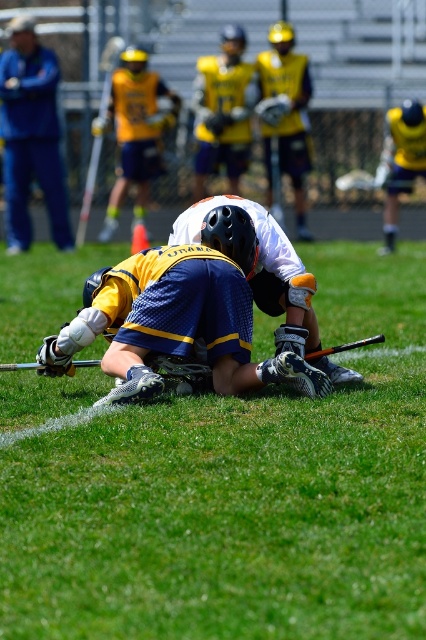
Question: Considering the real-world distances, which object is closest to the matte white hockey stick at upper left?

Choices:
 (A) blue mesh jersey at center
 (B) blue jersey at center

Answer: (B)

Question: Where is blue fabric jersey at center located in relation to black matte hockey stick at center in the image?

Choices:
 (A) left
 (B) right

Answer: (A)

Question: Estimate the real-world distances between objects in this image. Which object is farther from the black matte hockey stick at center?

Choices:
 (A) blue fabric jacket at upper left
 (B) blue jersey at center
 (C) blue fabric jersey at center
 (D) blue mesh jersey at center

Answer: (A)

Question: Can you confirm if blue mesh jersey at center is positioned to the right of blue fabric jacket at upper left?

Choices:
 (A) yes
 (B) no

Answer: (A)

Question: Which object is closer to the camera taking this photo?

Choices:
 (A) blue mesh jersey at center
 (B) blue fabric jersey at center
 (C) blue fabric jacket at upper left
 (D) blue jersey at center

Answer: (B)

Question: Can you confirm if blue fabric jersey at center is thinner than matte white hockey stick at upper left?

Choices:
 (A) no
 (B) yes

Answer: (A)